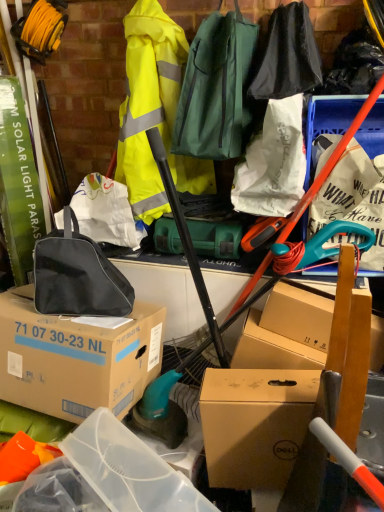
This screenshot has width=384, height=512. What do you see at coordinates (76, 357) in the screenshot?
I see `brown cardboard box at center, arranged as the second box when viewed from the right` at bounding box center [76, 357].

This screenshot has height=512, width=384. What do you see at coordinates (255, 424) in the screenshot? I see `brown cardboard box at center, which is the 2th box from left to right` at bounding box center [255, 424].

This screenshot has height=512, width=384. What are the coordinates of `green fabric bag at upper center, placed as the 2th luggage and bags when sorted from bottom to top` in the screenshot? It's located at (216, 89).

Image resolution: width=384 pixels, height=512 pixels. Find the location of `the 2nd clothing located above the white paper bag at upper center, which ranks as the second clothing in left-to-right order (from a real-world perspective)`. the 2nd clothing located above the white paper bag at upper center, which ranks as the second clothing in left-to-right order (from a real-world perspective) is located at coordinates (288, 56).

Can you confirm if black fabric bag at upper center, the 1th clothing positioned from the right, is smaller than white paper bag at upper center, which is the 2th clothing from right to left?

No.

From the image's perspective, would you say black fabric bag at upper center, placed as the 3th clothing when sorted from left to right, is positioned over white paper bag at upper center, which ranks as the second clothing in left-to-right order?

Yes, from the image's perspective, black fabric bag at upper center, placed as the 3th clothing when sorted from left to right, is above white paper bag at upper center, which ranks as the second clothing in left-to-right order.

Which is more to the left, black fabric bag at upper center, the 1th clothing positioned from the right, or white paper bag at upper center, which ranks as the second clothing in left-to-right order?

Positioned to the left is white paper bag at upper center, which ranks as the second clothing in left-to-right order.

Based on the photo, considering the sizes of objects black fabric bag at center-left, arranged as the 1th luggage and bags when viewed from the left, and brown cardboard box at center, which is the 2th box from left to right, in the image provided, who is thinner, black fabric bag at center-left, arranged as the 1th luggage and bags when viewed from the left, or brown cardboard box at center, which is the 2th box from left to right,?

black fabric bag at center-left, arranged as the 1th luggage and bags when viewed from the left, is thinner.

Is black fabric bag at center-left, which is counted as the 1th luggage and bags, starting from the bottom, inside the boundaries of brown cardboard box at center, the first box when ordered from right to left, or outside?

black fabric bag at center-left, which is counted as the 1th luggage and bags, starting from the bottom, cannot be found inside brown cardboard box at center, the first box when ordered from right to left.

I want to click on box that is the 2nd object located below the black fabric bag at center-left, arranged as the 2th luggage and bags when viewed from the top (from the image's perspective), so click(x=255, y=424).

Considering the sizes of objects black fabric bag at center-left, arranged as the 2th luggage and bags when viewed from the top, and brown cardboard box at center, the first box when ordered from right to left, in the image provided, who is bigger, black fabric bag at center-left, arranged as the 2th luggage and bags when viewed from the top, or brown cardboard box at center, the first box when ordered from right to left,?

With larger size is brown cardboard box at center, the first box when ordered from right to left.

Is high-visibility yellow jacket at upper center, marked as the first clothing in a left-to-right arrangement, completely or partially outside of black fabric bag at upper center, placed as the 3th clothing when sorted from left to right?

high-visibility yellow jacket at upper center, marked as the first clothing in a left-to-right arrangement, lies outside black fabric bag at upper center, placed as the 3th clothing when sorted from left to right,'s area.

Which object is positioned more to the left, high-visibility yellow jacket at upper center, arranged as the third clothing when viewed from the right, or black fabric bag at upper center, placed as the 3th clothing when sorted from left to right?

Positioned to the left is high-visibility yellow jacket at upper center, arranged as the third clothing when viewed from the right.

Is high-visibility yellow jacket at upper center, arranged as the third clothing when viewed from the right, beside black fabric bag at upper center, the 1th clothing positioned from the right?

high-visibility yellow jacket at upper center, arranged as the third clothing when viewed from the right, and black fabric bag at upper center, the 1th clothing positioned from the right, are clearly separated.

Considering the relative sizes of high-visibility yellow jacket at upper center, arranged as the third clothing when viewed from the right, and black fabric bag at upper center, the 1th clothing positioned from the right, in the image provided, is high-visibility yellow jacket at upper center, arranged as the third clothing when viewed from the right, thinner than black fabric bag at upper center, the 1th clothing positioned from the right,?

Yes.

Is green fabric bag at upper center, placed as the 2th luggage and bags when sorted from bottom to top, looking in the opposite direction of brown cardboard box at center, arranged as the second box when viewed from the right?

No.

Identify the location of box on the left of the green fabric bag at upper center, arranged as the 1th luggage and bags when viewed from the top. (76, 357).

Could brown cardboard box at center, which ranks as the first box in left-to-right order, be considered to be inside green fabric bag at upper center, placed as the 2th luggage and bags when sorted from bottom to top?

Actually, brown cardboard box at center, which ranks as the first box in left-to-right order, is outside green fabric bag at upper center, placed as the 2th luggage and bags when sorted from bottom to top.

Considering the positions of points (238, 136) and (155, 361), is point (238, 136) closer to camera compared to point (155, 361)?

Yes, point (238, 136) is in front of point (155, 361).

From the image's perspective, which box is the 1st one below the white paper bag at upper center, which ranks as the second clothing in left-to-right order? Please provide its 2D coordinates.

[(76, 357)]

Consider the image. From a real-world perspective, relative to brown cardboard box at center, which ranks as the first box in left-to-right order, is white paper bag at upper center, which is the 2th clothing from right to left, vertically above or below?

Clearly, from a real-world perspective, white paper bag at upper center, which is the 2th clothing from right to left, is above brown cardboard box at center, which ranks as the first box in left-to-right order.

How different are the orientations of white paper bag at upper center, which ranks as the second clothing in left-to-right order, and brown cardboard box at center, arranged as the second box when viewed from the right, in degrees?

The angular difference between white paper bag at upper center, which ranks as the second clothing in left-to-right order, and brown cardboard box at center, arranged as the second box when viewed from the right, is 1.72 degrees.

Does point (256, 136) appear closer or farther from the camera than point (138, 378)?

Point (256, 136) is positioned farther from the camera compared to point (138, 378).

What's the angular difference between brown cardboard box at center, which is the 2th box from left to right, and white paper bag at upper right's facing directions?

The angular difference between brown cardboard box at center, which is the 2th box from left to right, and white paper bag at upper right is 1.5 degrees.

In terms of height, does brown cardboard box at center, which is the 2th box from left to right, look taller or shorter compared to white paper bag at upper right?

In the image, brown cardboard box at center, which is the 2th box from left to right, appears to be shorter than white paper bag at upper right.

Is brown cardboard box at center, the first box when ordered from right to left, facing away from white paper bag at upper right?

brown cardboard box at center, the first box when ordered from right to left, is not turned away from white paper bag at upper right.

From a real-world perspective, relative to white paper bag at upper right, is brown cardboard box at center, which is the 2th box from left to right, vertically above or below?

brown cardboard box at center, which is the 2th box from left to right, is below white paper bag at upper right.

Considering the sizes of objects green fabric bag at upper center, arranged as the 1th luggage and bags when viewed from the top, and white paper bag at upper right in the image provided, who is smaller, green fabric bag at upper center, arranged as the 1th luggage and bags when viewed from the top, or white paper bag at upper right?

white paper bag at upper right is smaller.

Can you confirm if green fabric bag at upper center, arranged as the 1th luggage and bags when viewed from the top, is wider than white paper bag at upper right?

Yes, green fabric bag at upper center, arranged as the 1th luggage and bags when viewed from the top, is wider than white paper bag at upper right.

In the scene shown: Is green fabric bag at upper center, placed as the 2th luggage and bags when sorted from bottom to top, behind white paper bag at upper right?

No, it is not.

Where is `the 1st clothing behind the white paper bag at upper center, which is the 2th clothing from right to left, starting your count from the anchor`? The width and height of the screenshot is (384, 512). the 1st clothing behind the white paper bag at upper center, which is the 2th clothing from right to left, starting your count from the anchor is located at coordinates (288, 56).

The width and height of the screenshot is (384, 512). Find the location of `the 2nd box below the black fabric bag at center-left, which is counted as the 1th luggage and bags, starting from the bottom (from the image's perspective)`. the 2nd box below the black fabric bag at center-left, which is counted as the 1th luggage and bags, starting from the bottom (from the image's perspective) is located at coordinates (255, 424).

Considering their positions, is brown cardboard box at center, which ranks as the first box in left-to-right order, positioned closer to white paper bag at upper right than high-visibility yellow jacket at upper center, arranged as the third clothing when viewed from the right?

high-visibility yellow jacket at upper center, arranged as the third clothing when viewed from the right, is closer to white paper bag at upper right.

Based on their spatial positions, is brown cardboard box at center, which ranks as the first box in left-to-right order, or high-visibility yellow jacket at upper center, marked as the first clothing in a left-to-right arrangement, further from brown cardboard box at center, the first box when ordered from right to left?

high-visibility yellow jacket at upper center, marked as the first clothing in a left-to-right arrangement, is further to brown cardboard box at center, the first box when ordered from right to left.

From the image, which object appears to be nearer to black fabric bag at center-left, arranged as the 2th luggage and bags when viewed from the top, high-visibility yellow jacket at upper center, arranged as the third clothing when viewed from the right, or white paper bag at upper right?

high-visibility yellow jacket at upper center, arranged as the third clothing when viewed from the right, is positioned closer to the anchor black fabric bag at center-left, arranged as the 2th luggage and bags when viewed from the top.

When comparing their distances from black fabric bag at center-left, which ranks as the second luggage and bags in right-to-left order, does high-visibility yellow jacket at upper center, arranged as the third clothing when viewed from the right, or black fabric bag at upper center, the 1th clothing positioned from the right, seem closer?

high-visibility yellow jacket at upper center, arranged as the third clothing when viewed from the right, is closer to black fabric bag at center-left, which ranks as the second luggage and bags in right-to-left order.

In the scene shown: Estimate the real-world distances between objects in this image. Which object is closer to brown cardboard box at center, arranged as the second box when viewed from the right, green fabric bag at upper center, arranged as the 1th luggage and bags when viewed from the top, or black fabric bag at upper center, placed as the 3th clothing when sorted from left to right?

Based on the image, green fabric bag at upper center, arranged as the 1th luggage and bags when viewed from the top, appears to be nearer to brown cardboard box at center, arranged as the second box when viewed from the right.

Based on the photo, from the image, which object appears to be nearer to brown cardboard box at center, the first box when ordered from right to left, white paper bag at upper right or brown cardboard box at center, arranged as the second box when viewed from the right?

brown cardboard box at center, arranged as the second box when viewed from the right, is closer to brown cardboard box at center, the first box when ordered from right to left.

Which object lies further to the anchor point white paper bag at upper right, high-visibility yellow jacket at upper center, arranged as the third clothing when viewed from the right, or brown cardboard box at center, the first box when ordered from right to left?

brown cardboard box at center, the first box when ordered from right to left.

When comparing their distances from brown cardboard box at center, the first box when ordered from right to left, does high-visibility yellow jacket at upper center, arranged as the third clothing when viewed from the right, or white paper bag at upper center, which ranks as the second clothing in left-to-right order, seem further?

Based on the image, high-visibility yellow jacket at upper center, arranged as the third clothing when viewed from the right, appears to be further to brown cardboard box at center, the first box when ordered from right to left.

Locate an element on the screen. This screenshot has height=512, width=384. luggage and bags between black fabric bag at center-left, which ranks as the second luggage and bags in right-to-left order, and white paper bag at upper right is located at coordinates (216, 89).

I want to click on clothing between black fabric bag at center-left, which ranks as the second luggage and bags in right-to-left order, and white paper bag at upper center, which is the 2th clothing from right to left, from left to right, so click(x=154, y=112).

Locate an element on the screen. Image resolution: width=384 pixels, height=512 pixels. clothing between high-visibility yellow jacket at upper center, marked as the first clothing in a left-to-right arrangement, and brown cardboard box at center, which is the 2th box from left to right, from top to bottom is located at coordinates (273, 163).

In order to click on luggage and bags between high-visibility yellow jacket at upper center, arranged as the third clothing when viewed from the right, and brown cardboard box at center, arranged as the second box when viewed from the right, in the up-down direction in this screenshot , I will do `click(77, 275)`.